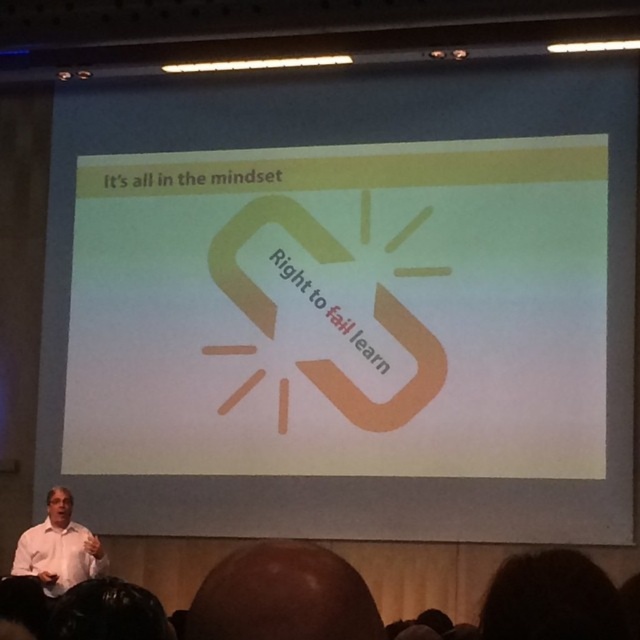
How much distance is there between white matte projection screen at center and smooth bald head at lower center?

white matte projection screen at center is 19.82 feet from smooth bald head at lower center.

From the picture: Can you confirm if white matte projection screen at center is taller than smooth bald head at lower center?

Yes.

Which is in front, point (54, 445) or point (280, 545)?

Point (280, 545) is more forward.

The image size is (640, 640). Identify the location of white matte projection screen at center. (346, 305).

Who is positioned more to the right, smooth bald head at lower center or white shirt at lower left?

smooth bald head at lower center

Which is more to the left, smooth bald head at lower center or white shirt at lower left?

white shirt at lower left

Is point (227, 634) closer to camera compared to point (102, 570)?

Yes, it is in front of point (102, 570).

In order to click on smooth bald head at lower center in this screenshot , I will do `click(282, 596)`.

Measure the distance between white matte projection screen at center and camera.

21.25 feet

Which is more to the right, white matte projection screen at center or white shirt at lower left?

From the viewer's perspective, white matte projection screen at center appears more on the right side.

Where is `white matte projection screen at center`? white matte projection screen at center is located at coordinates (346, 305).